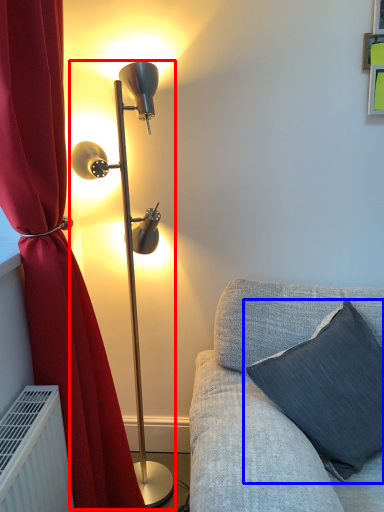
Question: Which point is closer to the camera, lamp (highlighted by a red box) or pillow (highlighted by a blue box)?

Choices:
 (A) lamp
 (B) pillow

Answer: (B)